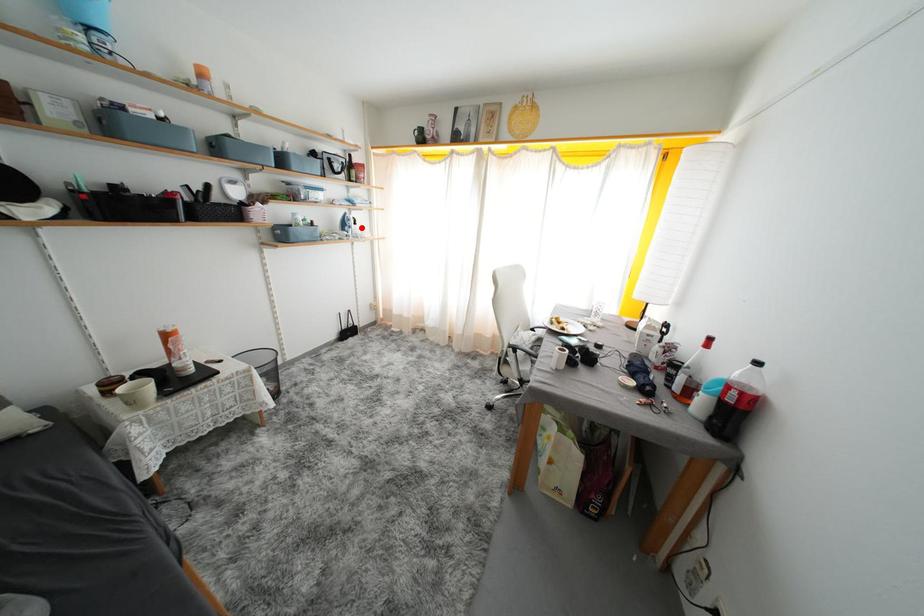
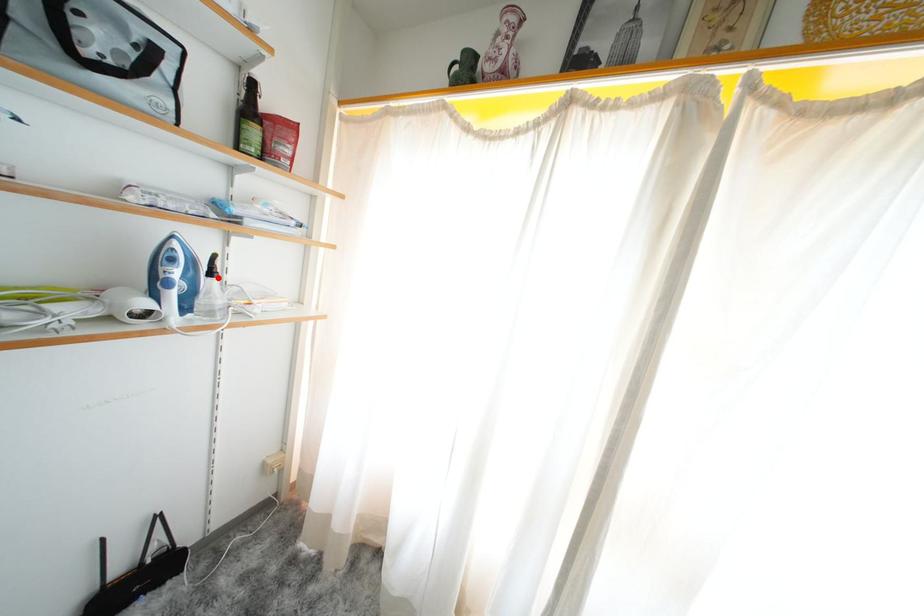
I am providing you with two images of the same scene from different viewpoints. A red point is marked on the first image and another point is marked on the second image. Does the point marked in image1 correspond to the same location as the one in image2?

Yes